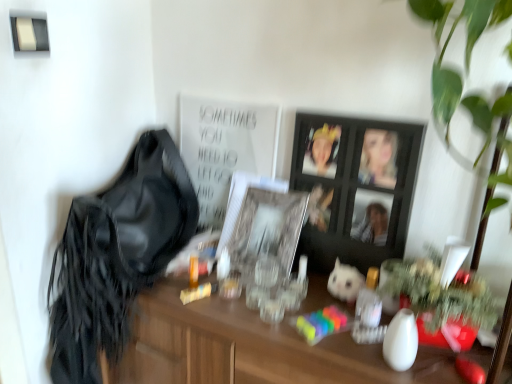
Question: Which direction should I rotate to look at black wooden picture frame at center, arranged as the second picture frame when viewed from the left?

Choices:
 (A) right
 (B) left

Answer: (A)

Question: Can you see white matte poster at upper center touching black wooden picture frame at center, acting as the 1th picture frame starting from the right?

Choices:
 (A) no
 (B) yes

Answer: (A)

Question: Is black wooden picture frame at center, acting as the 1th picture frame starting from the right, surrounded by white matte poster at upper center?

Choices:
 (A) no
 (B) yes

Answer: (A)

Question: Can you confirm if white matte poster at upper center is positioned to the left of black wooden picture frame at center, acting as the 1th picture frame starting from the right?

Choices:
 (A) yes
 (B) no

Answer: (A)

Question: Does white matte poster at upper center appear on the right side of black wooden picture frame at center, arranged as the second picture frame when viewed from the left?

Choices:
 (A) no
 (B) yes

Answer: (A)

Question: From a real-world perspective, is white matte poster at upper center on top of black wooden picture frame at center, acting as the 1th picture frame starting from the right?

Choices:
 (A) no
 (B) yes

Answer: (B)

Question: Is white matte poster at upper center closer to camera compared to black wooden picture frame at center, acting as the 1th picture frame starting from the right?

Choices:
 (A) no
 (B) yes

Answer: (A)

Question: Is white plush toy at center looking in the opposite direction of white matte poster at upper center?

Choices:
 (A) no
 (B) yes

Answer: (A)

Question: Can we say white plush toy at center lies outside white matte poster at upper center?

Choices:
 (A) no
 (B) yes

Answer: (B)

Question: From a real-world perspective, is white plush toy at center positioned under white matte poster at upper center based on gravity?

Choices:
 (A) no
 (B) yes

Answer: (B)

Question: Are white plush toy at center and white matte poster at upper center far apart?

Choices:
 (A) yes
 (B) no

Answer: (B)

Question: Can you confirm if white plush toy at center is thinner than white matte poster at upper center?

Choices:
 (A) no
 (B) yes

Answer: (A)

Question: From the image's perspective, is white plush toy at center located above white matte poster at upper center?

Choices:
 (A) no
 (B) yes

Answer: (A)

Question: Is the position of white matte poster at upper center more distant than that of satin black shoulder bag at left?

Choices:
 (A) yes
 (B) no

Answer: (A)